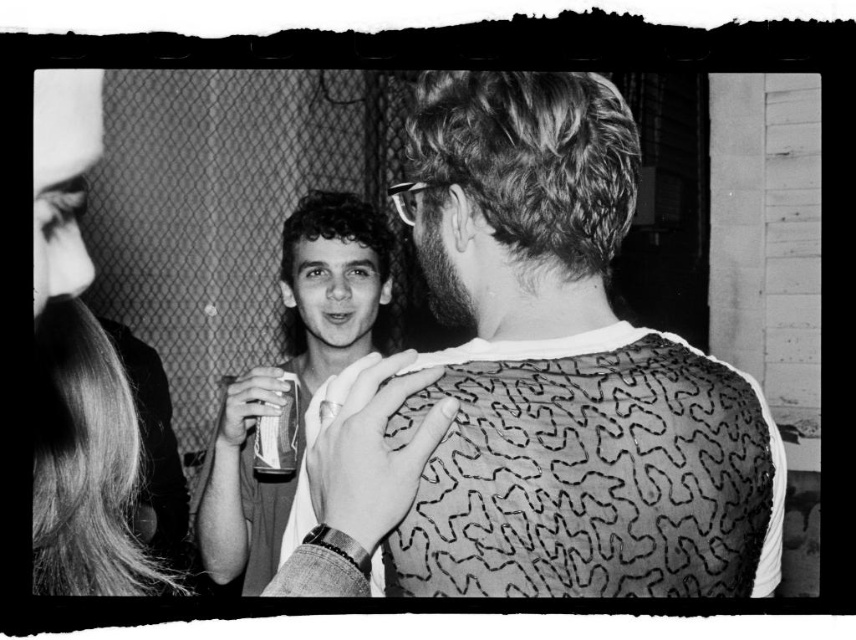
Can you confirm if patterned fabric shirt at center is shorter than smooth hair at left?

Indeed, patterned fabric shirt at center has a lesser height compared to smooth hair at left.

Is patterned fabric shirt at center above smooth hair at left?

Actually, patterned fabric shirt at center is below smooth hair at left.

Is point (554, 74) behind point (36, 330)?

Yes, it is behind point (36, 330).

Where is `patterned fabric shirt at center`? The width and height of the screenshot is (856, 640). patterned fabric shirt at center is located at coordinates (536, 384).

Is point (370, 412) farther from camera compared to point (266, 385)?

No, (370, 412) is closer to viewer.

Describe the element at coordinates (536, 384) in the screenshot. Image resolution: width=856 pixels, height=640 pixels. I see `patterned fabric shirt at center` at that location.

Is point (314, 561) more distant than point (259, 417)?

No, (314, 561) is in front of (259, 417).

Where is `patterned fabric shirt at center`? patterned fabric shirt at center is located at coordinates (536, 384).

Which is above, smooth hair at left or smooth white shirt at center?

Positioned higher is smooth hair at left.

Is point (73, 209) more distant than point (224, 502)?

That is False.

Describe the element at coordinates (79, 372) in the screenshot. The height and width of the screenshot is (640, 856). I see `smooth hair at left` at that location.

I want to click on smooth hair at left, so click(79, 372).